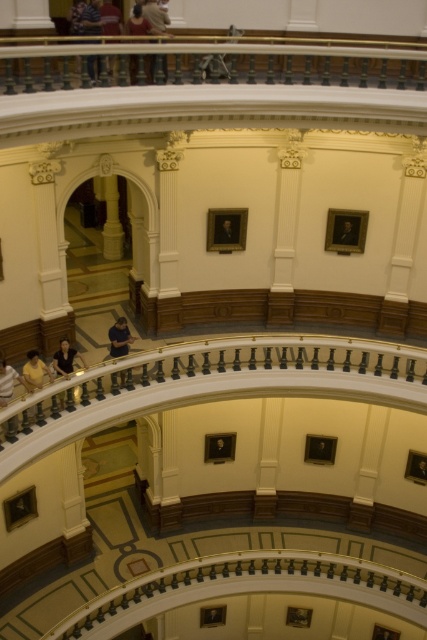
Question: Which object appears closest to the camera in this image?

Choices:
 (A) formal black suit at upper center
 (B) dark blue shirt at center
 (C) matte black shirt at upper center
 (D) matte black shirt at lower left

Answer: (C)

Question: Does denim pants at upper left have a lesser width compared to matte black shirt at lower left?

Choices:
 (A) no
 (B) yes

Answer: (B)

Question: Estimate the real-world distances between objects in this image. Which object is farther from the denim pants at upper left?

Choices:
 (A) dark blue shirt at center
 (B) matte black shirt at lower left

Answer: (B)

Question: In this image, where is matte black shirt at lower left located relative to wooden frame portrait at upper center?

Choices:
 (A) above
 (B) below

Answer: (B)

Question: Based on their relative distances, which object is farther from the matte black shirt at upper center?

Choices:
 (A) matte black shirt at lower left
 (B) dark blue shirt at lower left

Answer: (B)

Question: In this image, where is matte black shirt at upper center located relative to wooden frame portrait at upper center?

Choices:
 (A) right
 (B) left

Answer: (B)